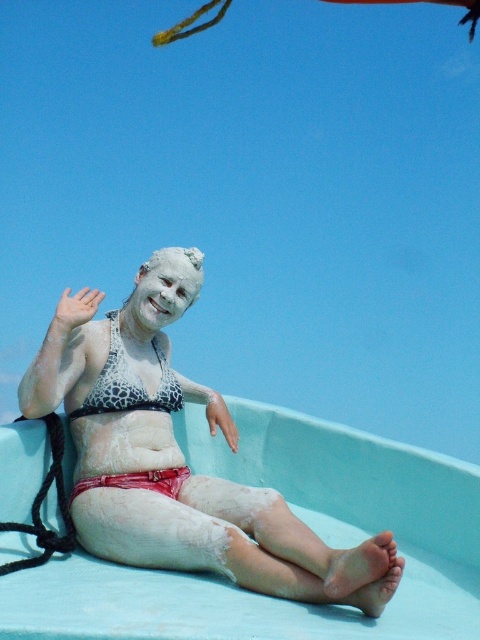
You are a photographer trying to capture a closeup shot of the white matte bikini at center and the white matte face at center. From the perspective of the camera, which object is positioned to the right of the other?

→ The white matte bikini at center is to the right of the white matte face at center.

You are standing at the edge of the light blue water slide and want to reach the point marked by point [127,422] and point [158,298]. Which point is closer to you?

Point [127,422] is in front of point [158,298], so it is closer to you.

You are a photographer standing at the camera position. You want to take a closeup shot of the leopard print bikini top at center. Given that your camera can focus on objects within 100 feet, will you be able to capture a clear closeup?

The leopard print bikini top at center is 136.62 feet away from the camera, which is beyond the camera focus range of 100 feet. Therefore, you cannot capture a clear closeup.